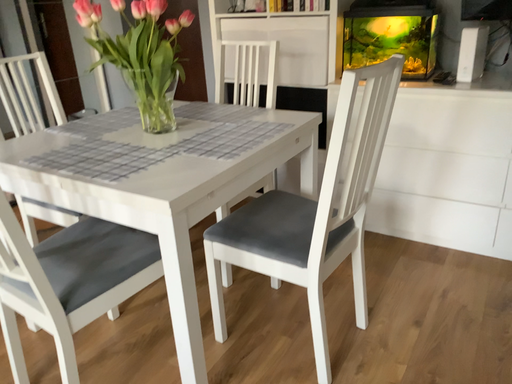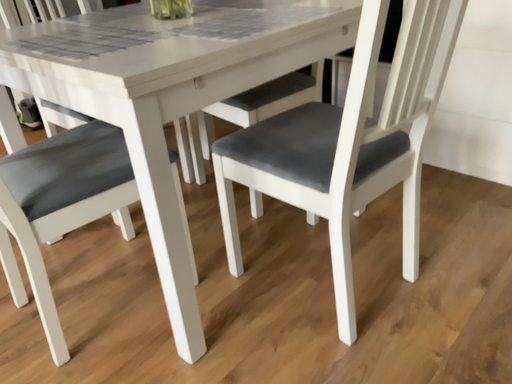
Question: How did the camera likely rotate when shooting the video?

Choices:
 (A) rotated downward
 (B) rotated upward

Answer: (A)